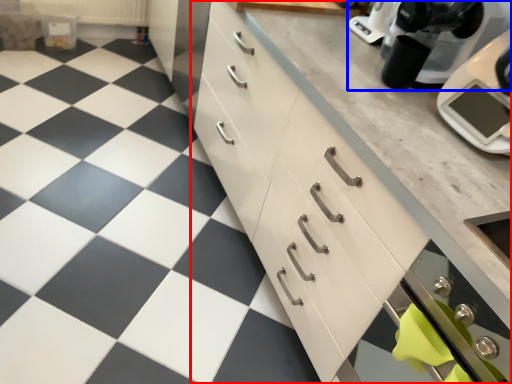
Question: Which object appears farthest to the camera in this image, cabinetry (highlighted by a red box) or kitchen appliance (highlighted by a blue box)?

Choices:
 (A) cabinetry
 (B) kitchen appliance

Answer: (B)